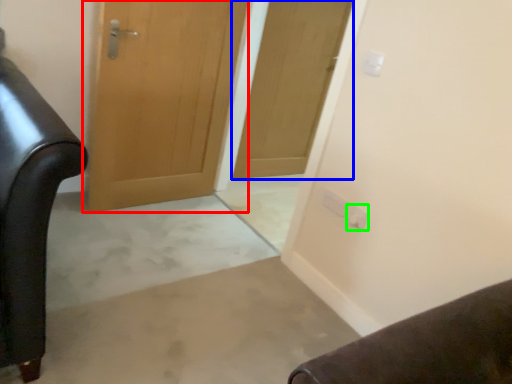
Question: Which object is the farthest from door (highlighted by a red box)? Choose among these: door (highlighted by a blue box) or electric outlet (highlighted by a green box).

Choices:
 (A) door
 (B) electric outlet

Answer: (B)